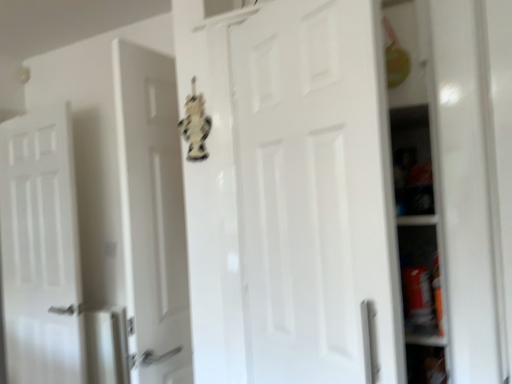
Question: From their relative heights in the image, would you say white matte door at left, which is counted as the 2th door, starting from the right, is taller or shorter than white matte door at center, the 2th door viewed from the left?

Choices:
 (A) short
 (B) tall

Answer: (B)

Question: Considering the positions of point (77, 339) and point (297, 49), is point (77, 339) closer or farther from the camera than point (297, 49)?

Choices:
 (A) closer
 (B) farther

Answer: (B)

Question: Which is correct: white matte door at left, which appears as the second door when viewed from the front, is inside white matte door at center, the second door positioned from the back, or outside of it?

Choices:
 (A) inside
 (B) outside

Answer: (B)

Question: In terms of width, does white matte door at center, which is counted as the first door, starting from the front, look wider or thinner when compared to white matte door at left, which appears as the second door when viewed from the front?

Choices:
 (A) thin
 (B) wide

Answer: (A)

Question: Is white matte door at center, which is counted as the first door, starting from the front, spatially inside white matte door at left, which is counted as the 2th door, starting from the right, or outside of it?

Choices:
 (A) outside
 (B) inside

Answer: (A)

Question: Is white matte door at center, the 2th door viewed from the left, bigger or smaller than white matte door at left, which is the first door in back-to-front order?

Choices:
 (A) big
 (B) small

Answer: (B)

Question: Is point (279, 185) closer or farther from the camera than point (57, 238)?

Choices:
 (A) closer
 (B) farther

Answer: (A)